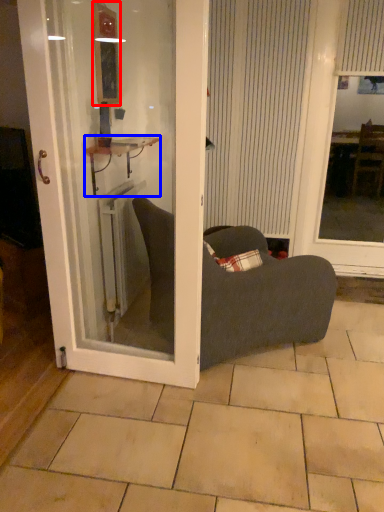
Question: Which of the following is the closest to the observer, mirror (highlighted by a red box) or cabinetry (highlighted by a blue box)?

Choices:
 (A) mirror
 (B) cabinetry

Answer: (B)